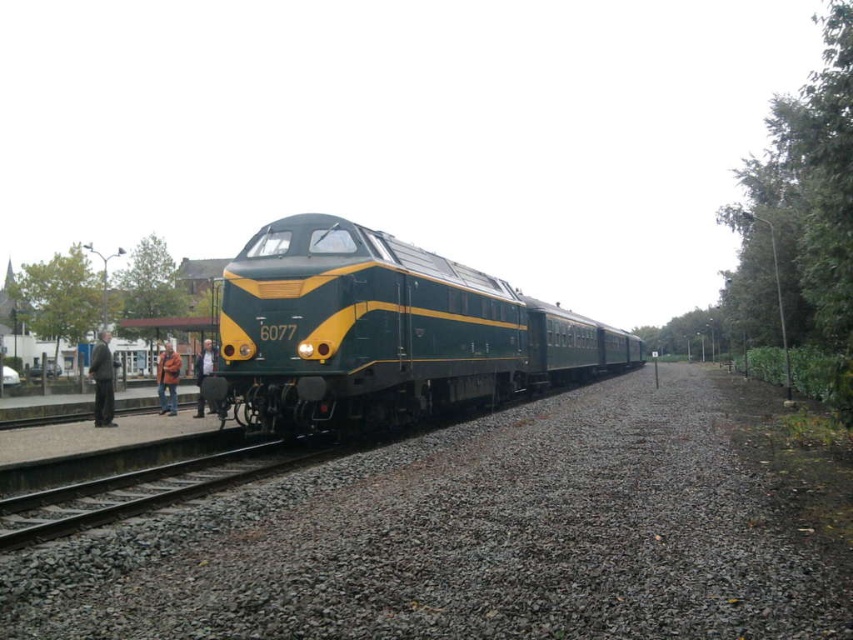
Is gray gravel track at lower left taller than brown leather jacket at lower left?

In fact, gray gravel track at lower left may be shorter than brown leather jacket at lower left.

Can you confirm if gray gravel track at lower left is wider than brown leather jacket at lower left?

Incorrect, gray gravel track at lower left's width does not surpass brown leather jacket at lower left's.

What do you see at coordinates (144, 490) in the screenshot? This screenshot has width=853, height=640. I see `gray gravel track at lower left` at bounding box center [144, 490].

Where is `gray gravel track at lower left`? The width and height of the screenshot is (853, 640). gray gravel track at lower left is located at coordinates (144, 490).

Is green polished metal train at center to the right of brown leather jacket at lower left from the viewer's perspective?

Yes, green polished metal train at center is to the right of brown leather jacket at lower left.

Which of these two, green polished metal train at center or brown leather jacket at lower left, stands taller?

Standing taller between the two is green polished metal train at center.

The width and height of the screenshot is (853, 640). What are the coordinates of `green polished metal train at center` in the screenshot? It's located at (384, 332).

Based on the photo, can you confirm if green polished metal train at center is wider than dark gray suit at left?

Yes, green polished metal train at center is wider than dark gray suit at left.

Locate an element on the screen. green polished metal train at center is located at coordinates (384, 332).